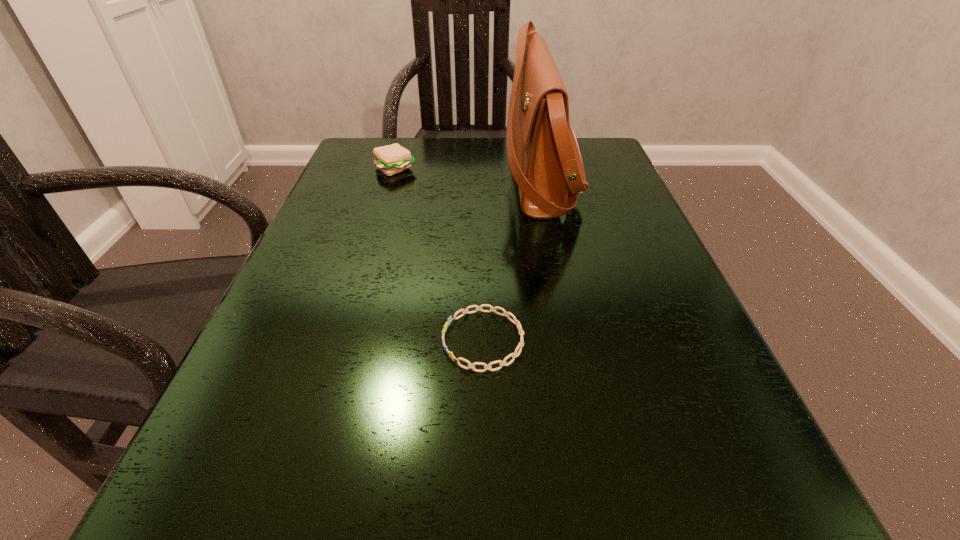
Identify the location of vacant area that lies between the leftmost object and the bracelet. Image resolution: width=960 pixels, height=540 pixels. (440, 254).

Identify the location of vacant region between the leftmost object and the satchel. The height and width of the screenshot is (540, 960). (468, 172).

Locate an element on the screen. The image size is (960, 540). empty location between the satchel and the leftmost object is located at coordinates (468, 172).

Locate an element on the screen. vacant area between the tallest object and the patty is located at coordinates (468, 172).

Identify the location of the second closest object to the tallest object. (502, 363).

Identify which object is the closest to the patty. Please provide its 2D coordinates. Your answer should be formatted as a tuple, i.e. [(x, y)], where the tuple contains the x and y coordinates of a point satisfying the conditions above.

[(544, 157)]